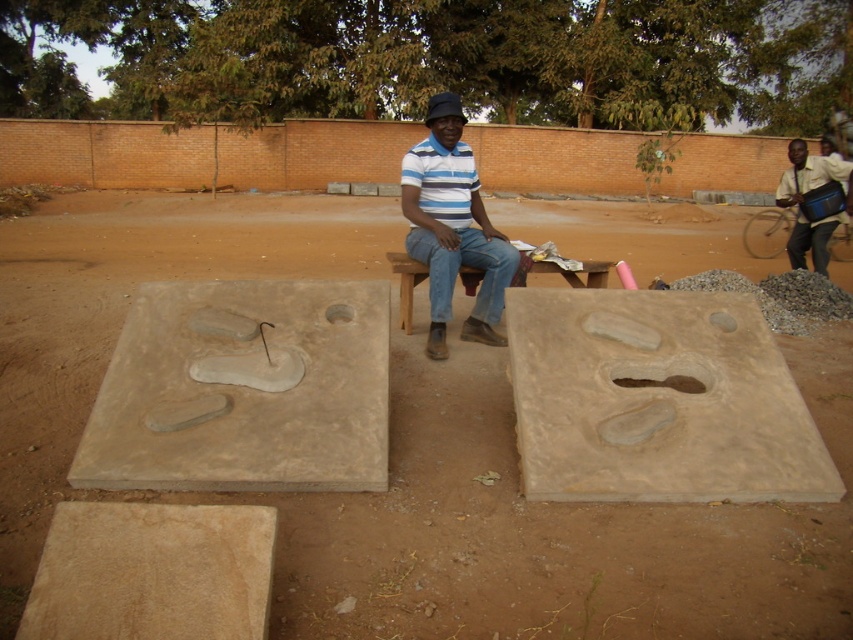
Question: Which point is closer to the camera taking this photo?

Choices:
 (A) (306, 385)
 (B) (74, 289)
 (C) (416, 228)
 (D) (190, 554)

Answer: (D)

Question: Based on their relative distances, which object is farther from the brown concrete slab at center?

Choices:
 (A) light brown leather bag at right
 (B) matte striped shirt at center
 (C) beige concrete slab at lower left

Answer: (A)

Question: Which point is farther from the camera taking this photo?

Choices:
 (A) (154, 332)
 (B) (799, 264)
 (C) (773, 378)
 (D) (157, 595)

Answer: (B)

Question: Is matte striped shirt at center smaller than light brown leather bag at right?

Choices:
 (A) yes
 (B) no

Answer: (A)

Question: Is brown dirt field at center below matte striped shirt at center?

Choices:
 (A) yes
 (B) no

Answer: (B)

Question: Is beige concrete slab at center wider than matte striped shirt at center?

Choices:
 (A) yes
 (B) no

Answer: (A)